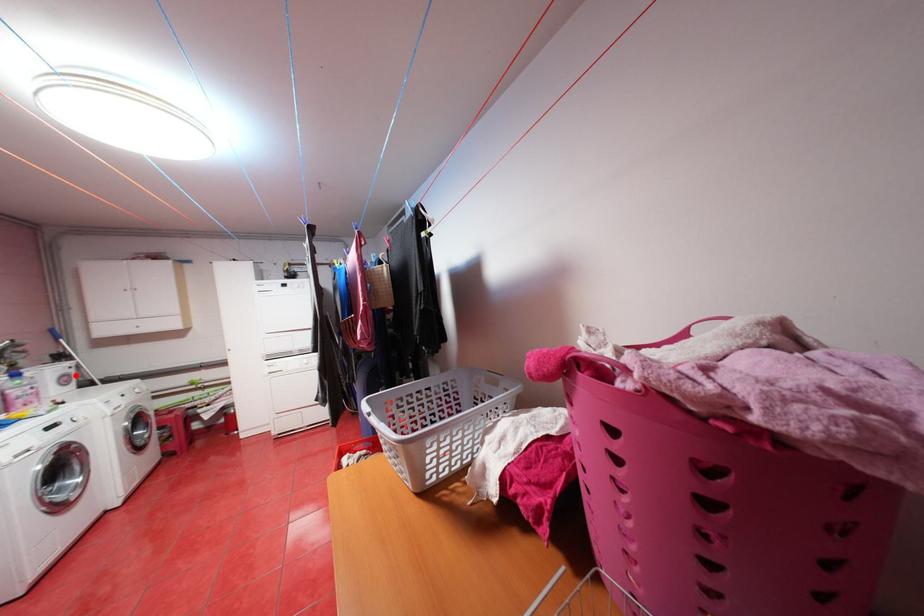
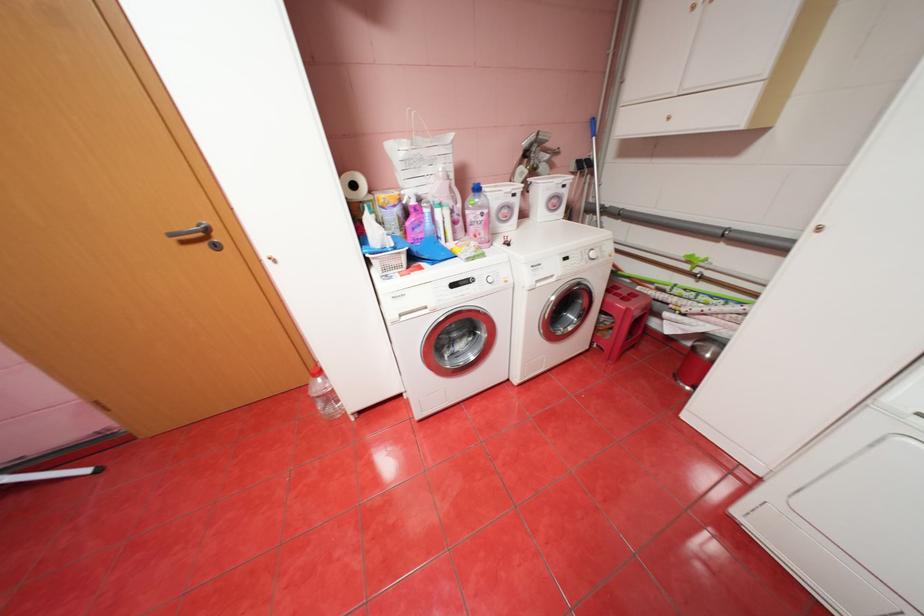
Question: I am providing you with two images of the same scene from different viewpoints. Given a red point in image1, look at the same physical point in image2. Is it:

Choices:
 (A) Closer to the viewpoint
 (B) Farther from the viewpoint

Answer: (A)